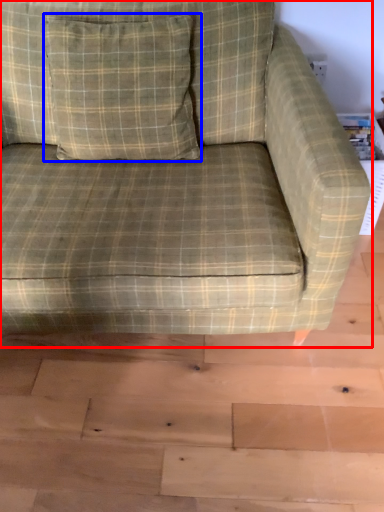
Question: Which object appears farthest to the camera in this image, studio couch (highlighted by a red box) or throw pillow (highlighted by a blue box)?

Choices:
 (A) studio couch
 (B) throw pillow

Answer: (B)